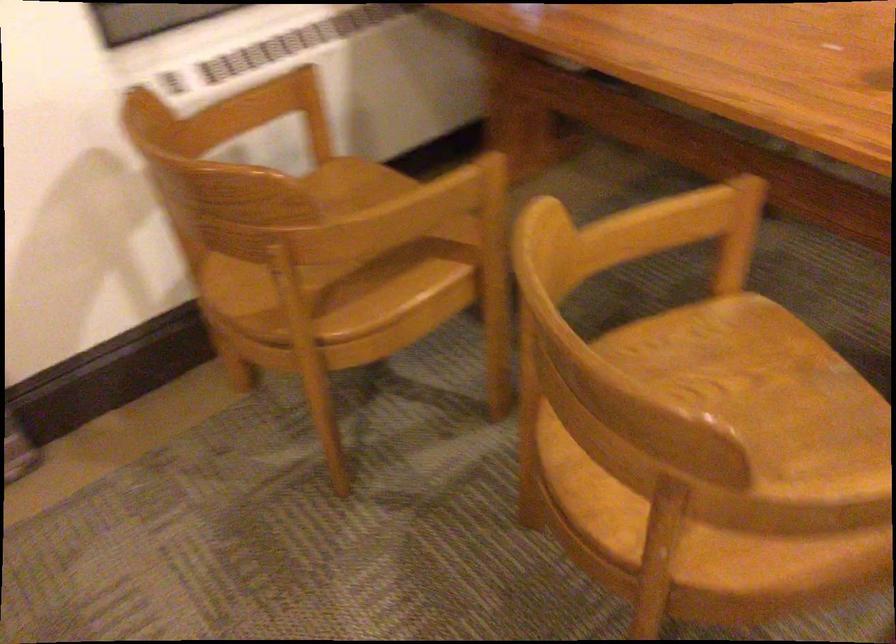
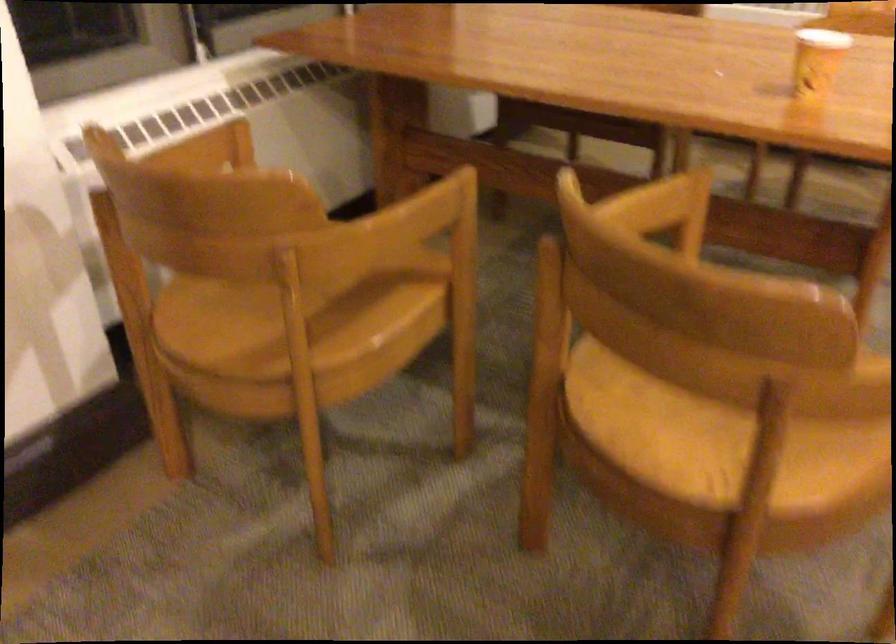
Question: In a continuous first-person perspective shot, in which direction is the camera moving?

Choices:
 (A) Left
 (B) Right
 (C) Forward
 (D) Backward

Answer: (A)